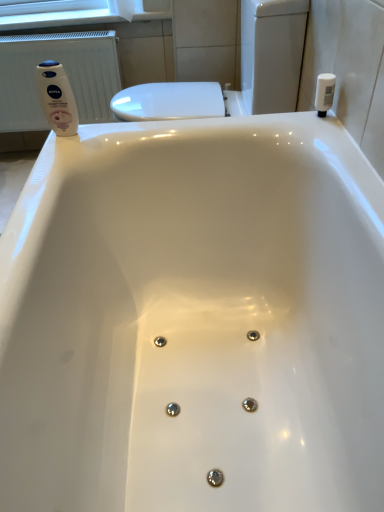
Locate an element on the screen. vacant space situated above white plastic radiator at left (from a real-world perspective) is located at coordinates (57, 36).